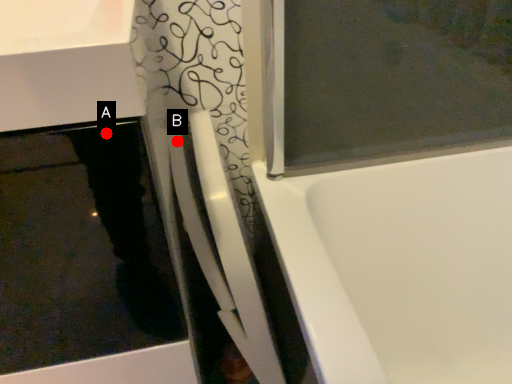
Question: Two points are circled on the image, labeled by A and B beside each circle. Which point is closer to the camera?

Choices:
 (A) A is closer
 (B) B is closer

Answer: (A)